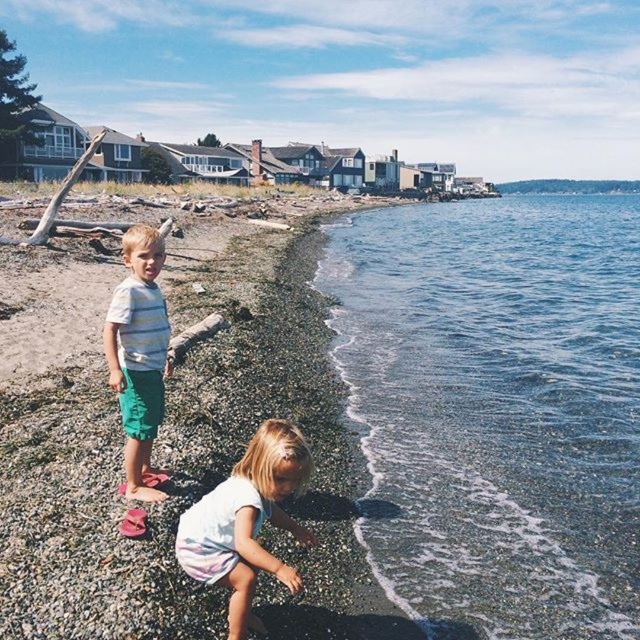
Consider the image. You are a photographer trying to capture both the light pink cotton dress at lower center and the striped cotton shirt at center in a single shot. Based on their positions, which one is closer to the camera?

The light pink cotton dress at lower center is below the striped cotton shirt at center, so the striped cotton shirt at center is closer to the camera.